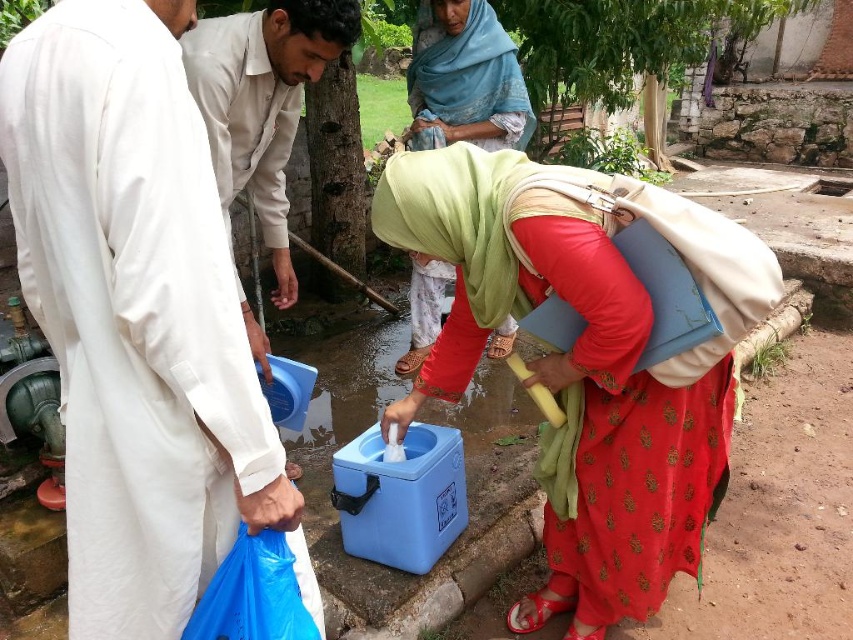
Can you confirm if beige cotton shirt at left is smaller than matte green scarf at center?

Incorrect, beige cotton shirt at left is not smaller in size than matte green scarf at center.

Can you confirm if beige cotton shirt at left is positioned above matte green scarf at center?

No, beige cotton shirt at left is not above matte green scarf at center.

Locate an element on the screen. This screenshot has height=640, width=853. beige cotton shirt at left is located at coordinates (262, 102).

Between matte blue cooler at center and beige cotton shirt at left, which one is positioned higher?

beige cotton shirt at left

Which is behind, point (527, 262) or point (289, 33)?

The point (289, 33) is behind.

Is point (444, 388) closer to camera compared to point (221, 177)?

That is True.

This screenshot has width=853, height=640. I want to click on matte blue cooler at center, so click(x=566, y=380).

Who is positioned more to the right, white matte robe at left or matte blue cooler at center?

From the viewer's perspective, matte blue cooler at center appears more on the right side.

Is white matte robe at left wider than matte blue cooler at center?

No.

Locate an element on the screen. white matte robe at left is located at coordinates (136, 316).